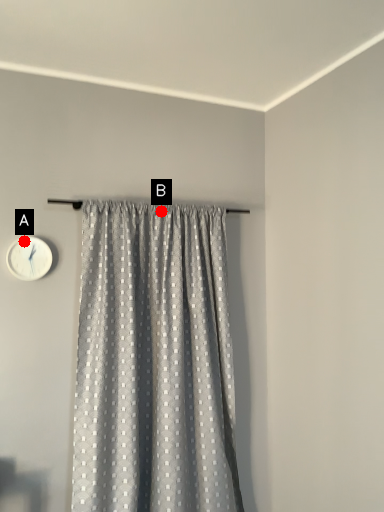
Question: Two points are circled on the image, labeled by A and B beside each circle. Among these points, which one is nearest to the camera?

Choices:
 (A) A is closer
 (B) B is closer

Answer: (A)